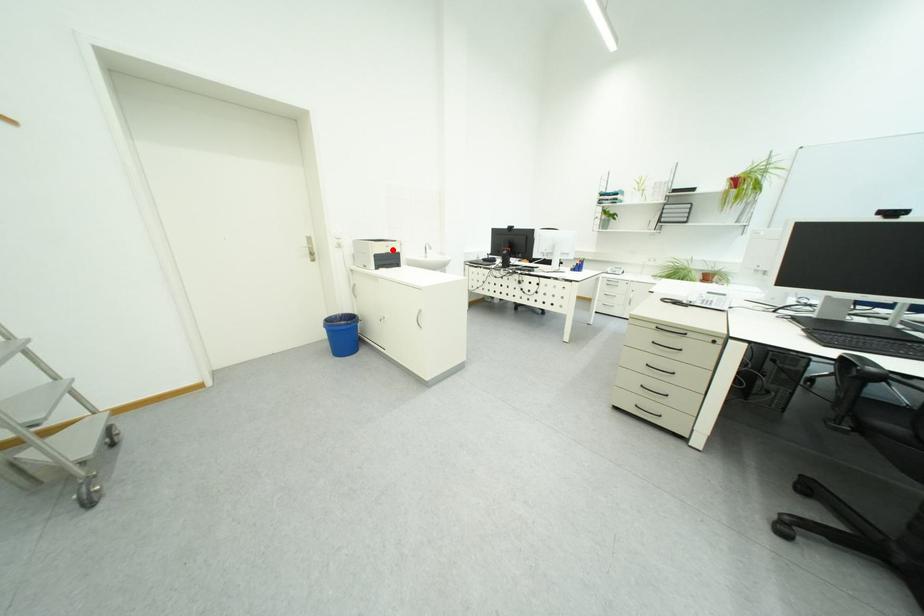
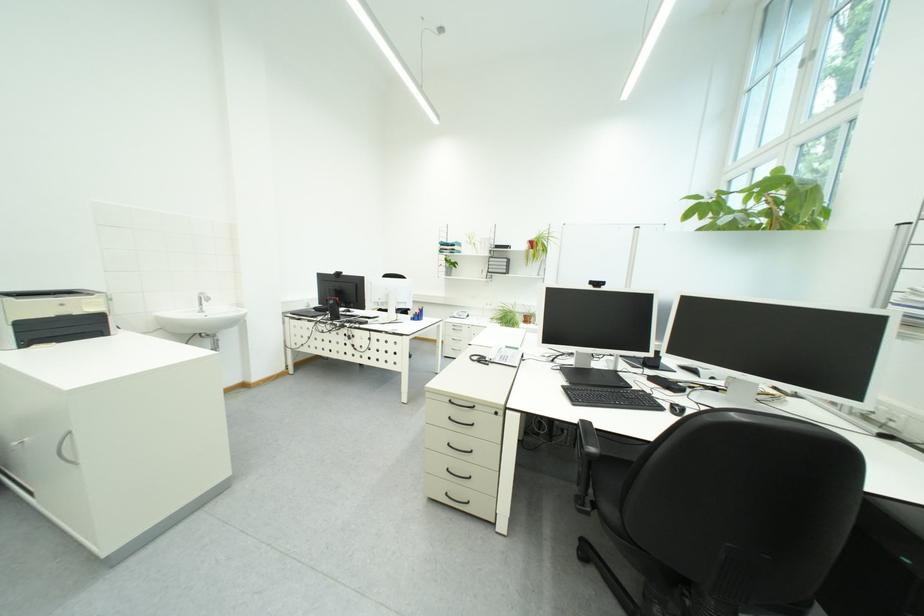
Question: I am providing you with two images of the same scene from different viewpoints. A red point is shown in image1. For the corresponding object point in image2, is it positioned nearer or farther from the camera?

Choices:
 (A) Nearer
 (B) Farther

Answer: (B)